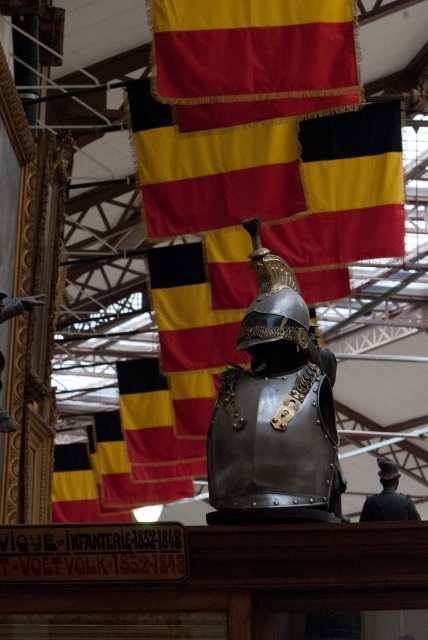
You are a museum visitor standing in front of the historical display. You see the red fabric flag at upper center and the shiny silver helmet at center. Which object is located higher in the image?

The red fabric flag at upper center is located higher than the shiny silver helmet at center.